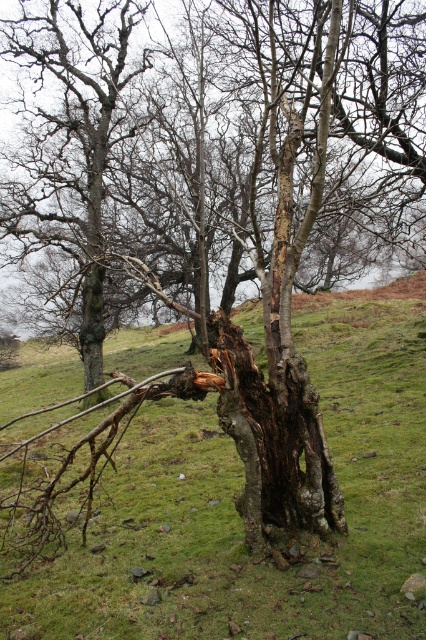
From the picture: You are a gardener who needs to place a 6.5 feet long wooden fence between the green grassy at center and the dark brown rough bark at center. Can you fit the fence between them without it overlapping either object?

The distance between the green grassy at center and the dark brown rough bark at center is 7.18 feet. Since the fence is 6.5 feet long, which is shorter than the distance between them, the fence can be placed between them without overlapping either object.

You are a gardener who wants to plant a new flower bed. You have two areas to choose from in the image. One is the green grassy at center and the other is the dark brown rough bark at center. Which area would be more suitable for planting flowers?

The green grassy at center is more suitable for planting flowers because it is positioned over the dark brown rough bark at center, indicating it has soil beneath it which is better for plant growth.

You are standing at the point marked as point (238, 515) in the image. Looking around, you see the damaged tree in the foreground. Which direction should you walk to reach the green grassy area at center?

The point (238, 515) is already located on the green grassy area at center, so you are already there.